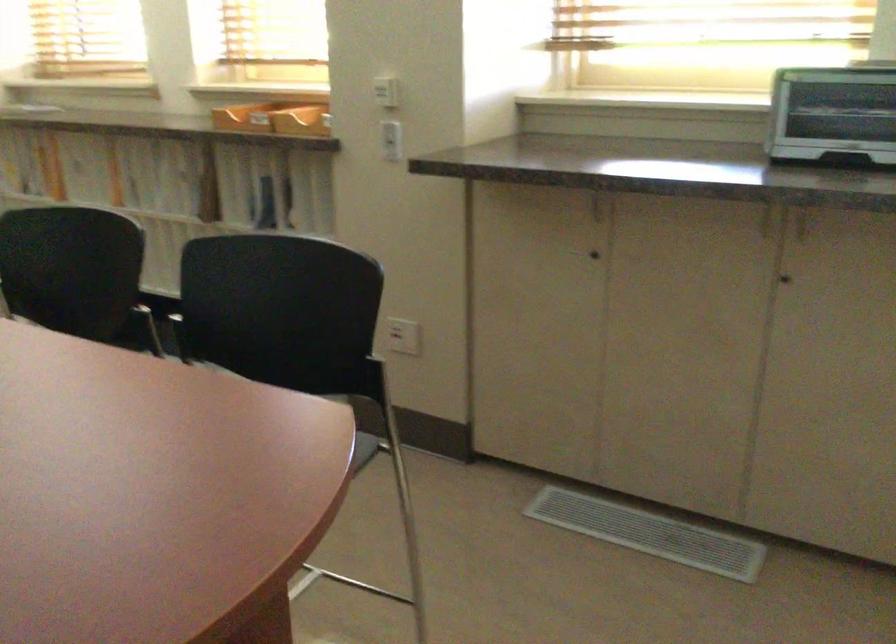
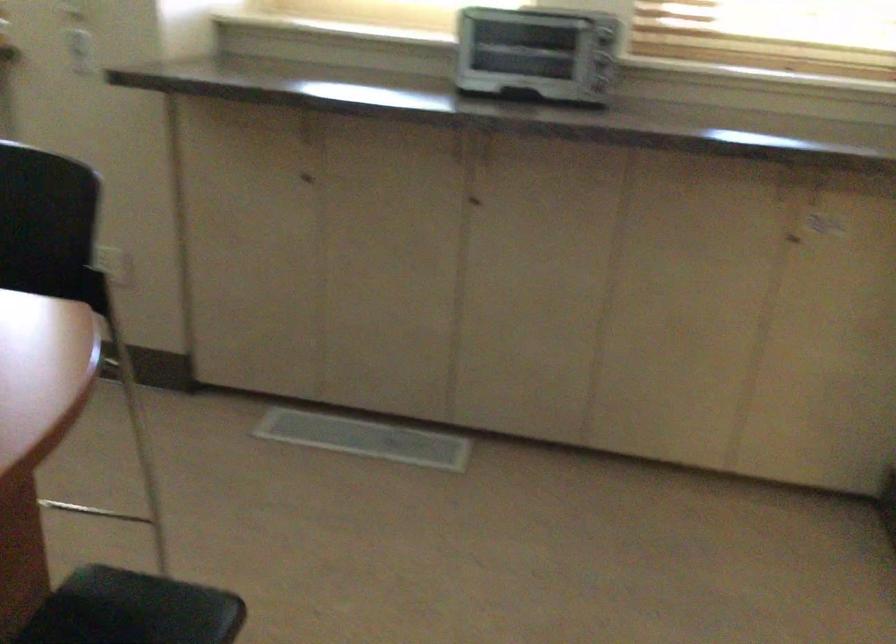
Question: The camera is either moving clockwise (left) or counter-clockwise (right) around the object. The first image is from the beginning of the video and the second image is from the end. Is the camera moving left or right when shooting the video?

Choices:
 (A) Left
 (B) Right

Answer: (A)